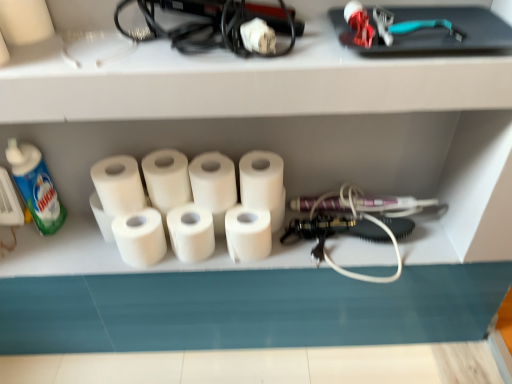
You are a GUI agent. You are given a task and a screenshot of the screen. Output one action in this format:
    pyautogui.click(x=<x>, y=<y>)
    Task: Click on the vacant space that is in between green matte bottle at left and white matte toilet paper at center, acting as the second toilet paper starting from the left
    The height and width of the screenshot is (384, 512).
    Given the screenshot: What is the action you would take?
    pyautogui.click(x=80, y=238)